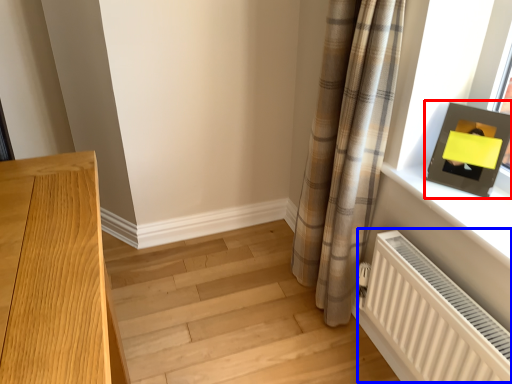
Question: Which object appears farthest to the camera in this image, picture frame (highlighted by a red box) or radiator (highlighted by a blue box)?

Choices:
 (A) picture frame
 (B) radiator

Answer: (A)